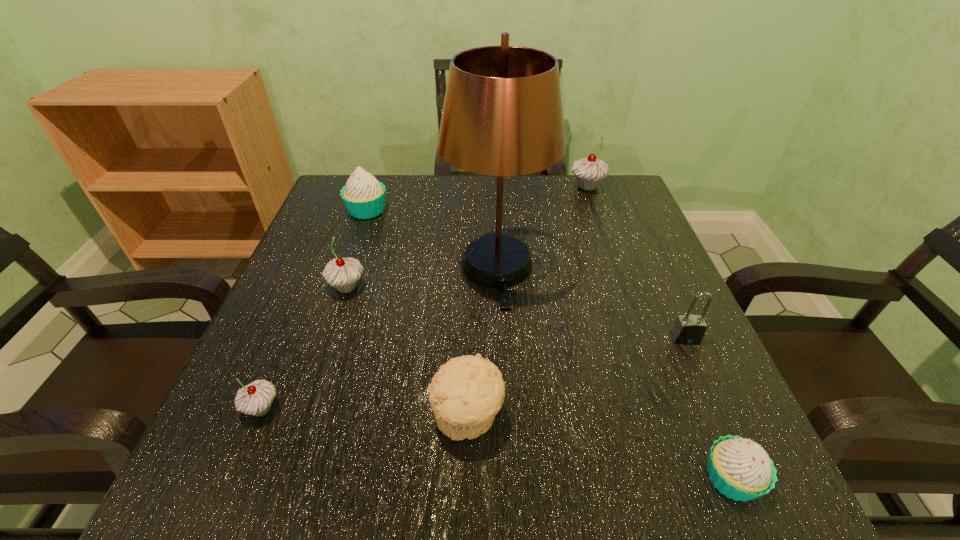
This screenshot has height=540, width=960. I want to click on free space that satisfies the following two spatial constraints: 1. on the back side of the fourth farthest cupcake; 2. on the right side of the third nearest cupcake, so click(x=312, y=287).

Find the location of a particular element. free region that satisfies the following two spatial constraints: 1. on the back side of the tallest cupcake; 2. on the right side of the beige muffin is located at coordinates (472, 186).